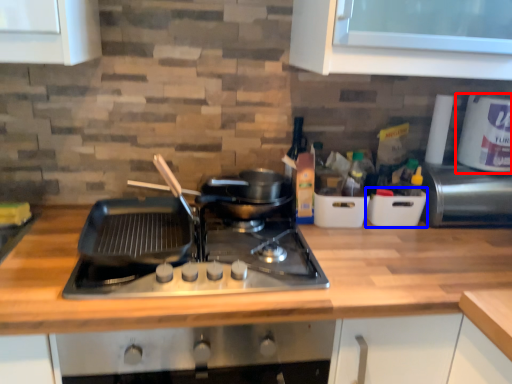
Question: Which object appears closest to the camera in this image, kitchen appliance (highlighted by a red box) or appliance (highlighted by a blue box)?

Choices:
 (A) kitchen appliance
 (B) appliance

Answer: (A)